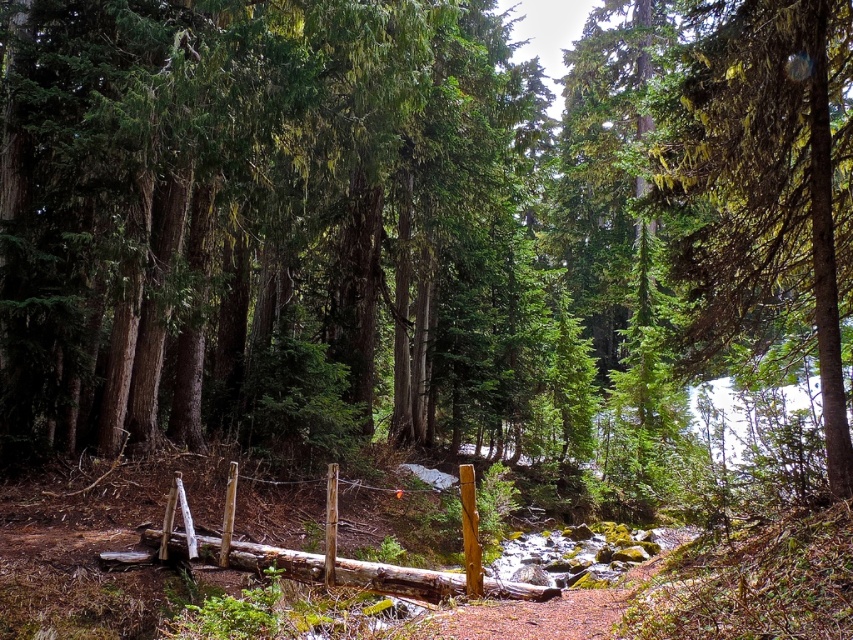
From the picture: Is green mossy tree at upper right closer to the viewer compared to natural wood log at center?

Yes, it is.

What do you see at coordinates (767, 177) in the screenshot? The width and height of the screenshot is (853, 640). I see `green mossy tree at upper right` at bounding box center [767, 177].

This screenshot has height=640, width=853. I want to click on green mossy tree at upper right, so click(x=767, y=177).